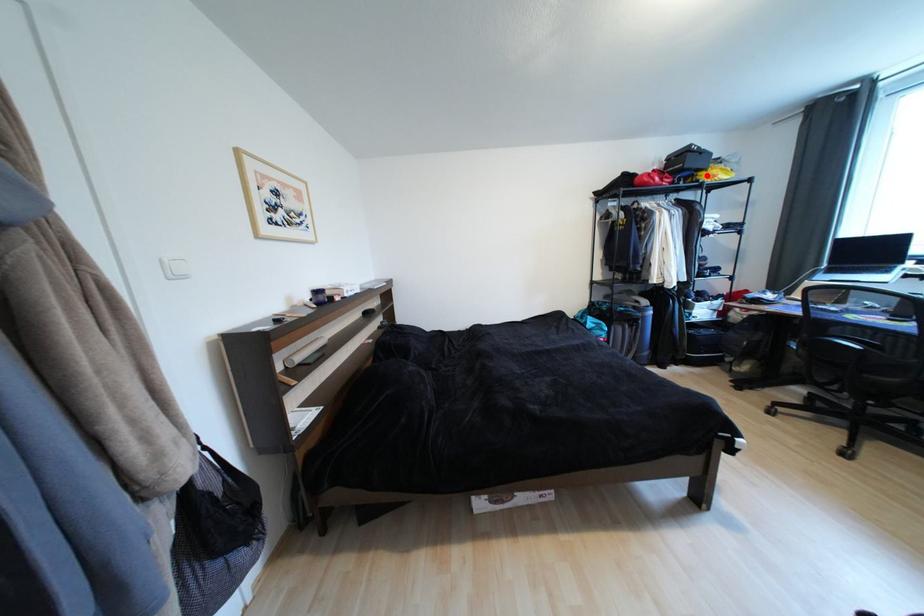
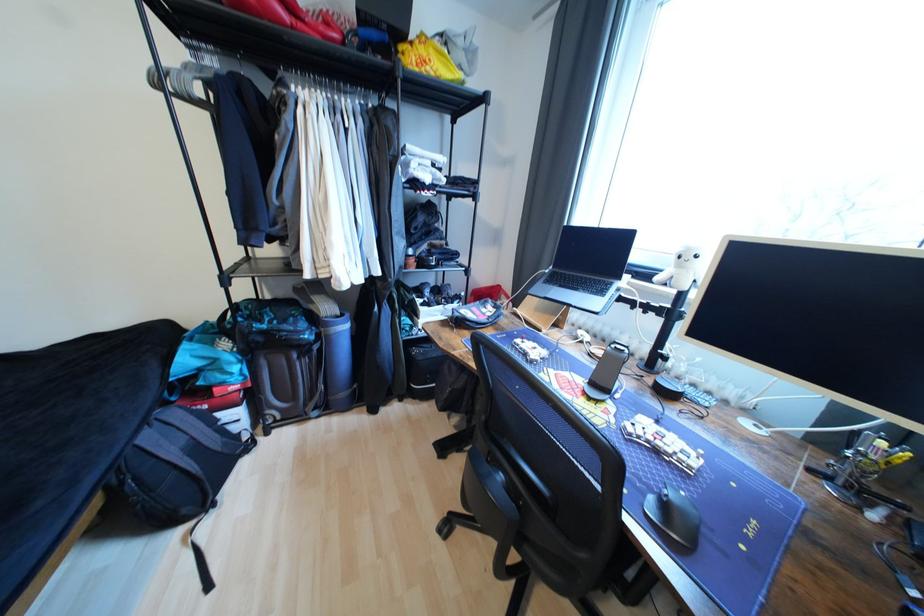
Where in the second image is the point corresponding to the highlighted location from the first image?

(407, 49)